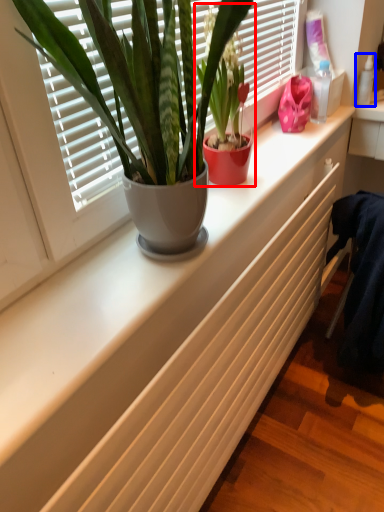
Question: Which object appears closest to the camera in this image, houseplant (highlighted by a red box) or toiletry (highlighted by a blue box)?

Choices:
 (A) houseplant
 (B) toiletry

Answer: (A)